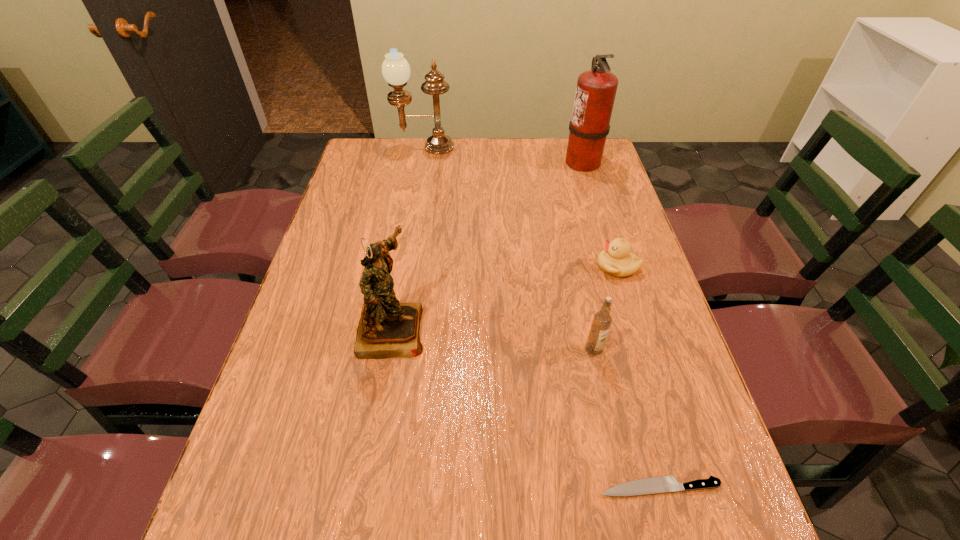
Identify the location of oil lamp present at the left edge. Image resolution: width=960 pixels, height=540 pixels. (395, 69).

Where is `figurine positioned at the left edge`? This screenshot has width=960, height=540. figurine positioned at the left edge is located at coordinates (387, 328).

Image resolution: width=960 pixels, height=540 pixels. In order to click on fire extinguisher that is at the right edge in this screenshot , I will do `click(596, 89)`.

This screenshot has height=540, width=960. I want to click on duckling present at the right edge, so point(616,259).

What are the coordinates of `steak knife at the right edge` in the screenshot? It's located at (661, 484).

Image resolution: width=960 pixels, height=540 pixels. I want to click on object positioned at the far left corner, so click(x=395, y=69).

Where is `object at the far right corner`? The height and width of the screenshot is (540, 960). object at the far right corner is located at coordinates (596, 89).

At what (x,y) coordinates should I click in order to perform the action: click on vacant space at the far edge of the desktop. Please return your answer as a coordinate pair (x, y). This screenshot has height=540, width=960. Looking at the image, I should click on (427, 153).

This screenshot has width=960, height=540. What are the coordinates of `vacant area at the left edge of the desktop` in the screenshot? It's located at (312, 348).

Find the location of a particular element. The image size is (960, 540). vacant area at the right edge of the desktop is located at coordinates (572, 185).